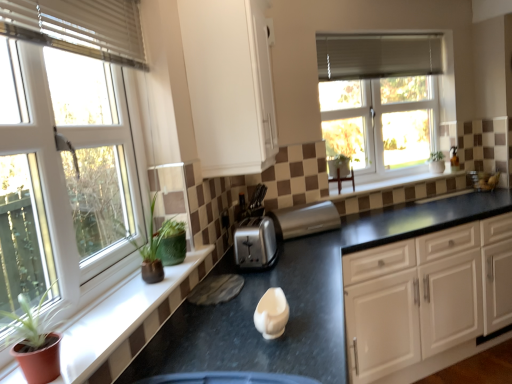
This screenshot has height=384, width=512. Identify the location of empty space that is to the right of satin silver toaster at center, the second appliance viewed from the right. (305, 262).